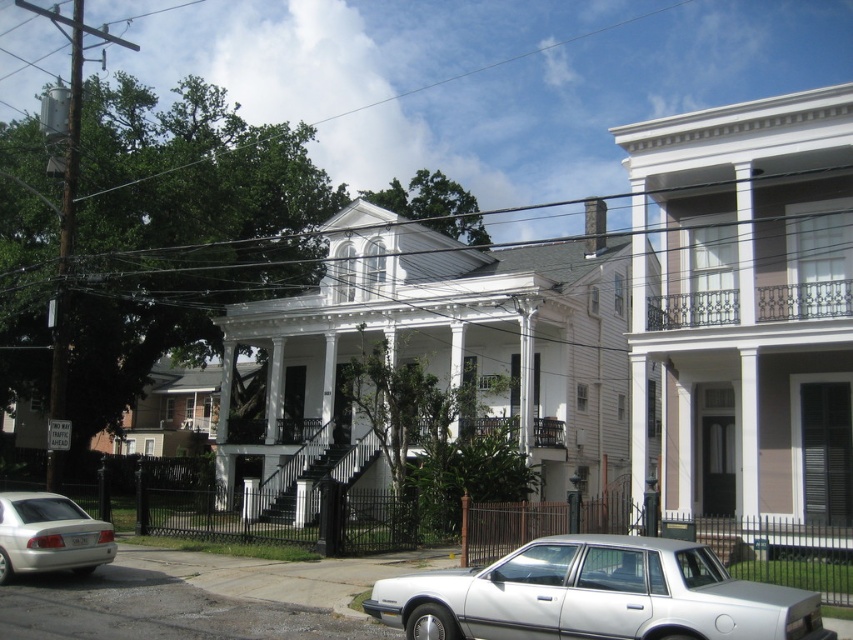
Who is lower down, white matte sedan at lower center or silver metallic sedan at lower left?

silver metallic sedan at lower left

Is white matte sedan at lower center below silver metallic sedan at lower left?

Incorrect, white matte sedan at lower center is not positioned below silver metallic sedan at lower left.

Does point (427, 580) lie in front of point (39, 557)?

Yes, it is.

Identify the location of white matte sedan at lower center. (595, 595).